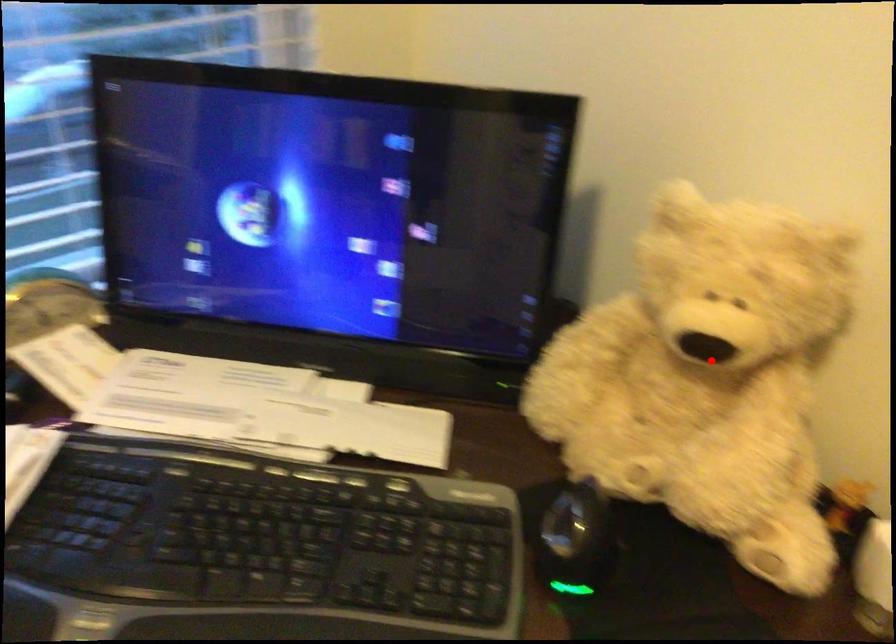
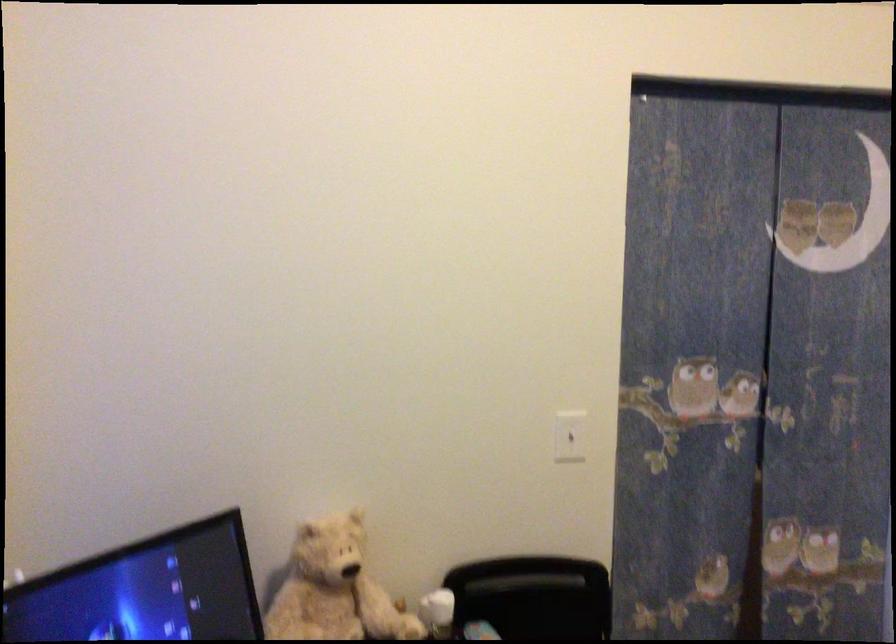
Question: I am providing you with two images of the same scene from different viewpoints. In image1, a red point is highlighted. Considering the same 3D point in image2, which of the following is correct?

Choices:
 (A) It is closer
 (B) It is farther

Answer: (B)